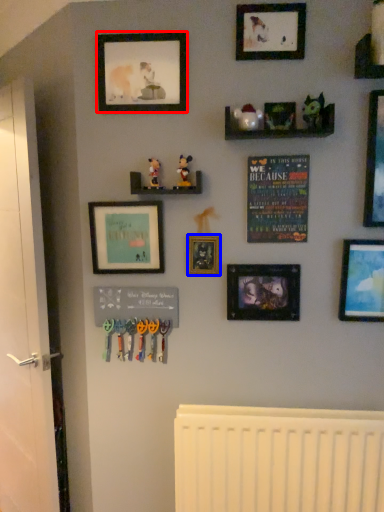
Question: Which object is closer to the camera taking this photo, picture frame (highlighted by a red box) or picture frame (highlighted by a blue box)?

Choices:
 (A) picture frame
 (B) picture frame

Answer: (A)